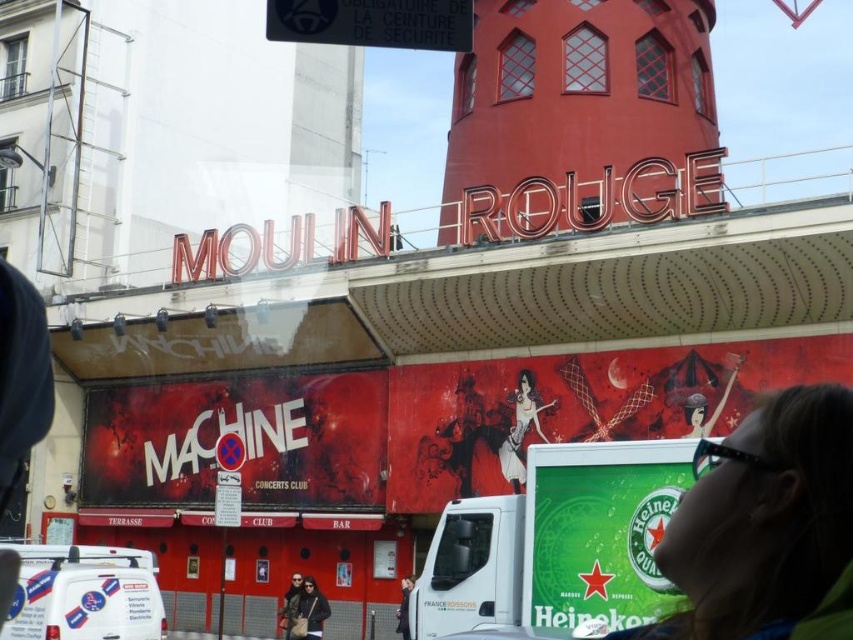
Which is behind, point (822, 419) or point (115, 611)?

The point (115, 611) is behind.

Where is `matte black sunglasses at upper right`? matte black sunglasses at upper right is located at coordinates (761, 520).

Between matte black jacket at lower center and dark gray jacket at lower center, which one is positioned lower?

matte black jacket at lower center

Can you confirm if matte black jacket at lower center is taller than dark gray jacket at lower center?

Correct, matte black jacket at lower center is much taller as dark gray jacket at lower center.

Is point (308, 636) positioned in front of point (410, 573)?

Yes, it is.

Find the location of a particular element. matte black jacket at lower center is located at coordinates (309, 611).

Is green matte heineken sign at lower right closer to camera compared to black plastic sign at upper center?

Yes.

Who is higher up, green matte heineken sign at lower right or black plastic sign at upper center?

Positioned higher is black plastic sign at upper center.

Locate an element on the screen. The image size is (853, 640). green matte heineken sign at lower right is located at coordinates click(x=556, y=541).

Find the location of a particular element. green matte heineken sign at lower right is located at coordinates point(556,541).